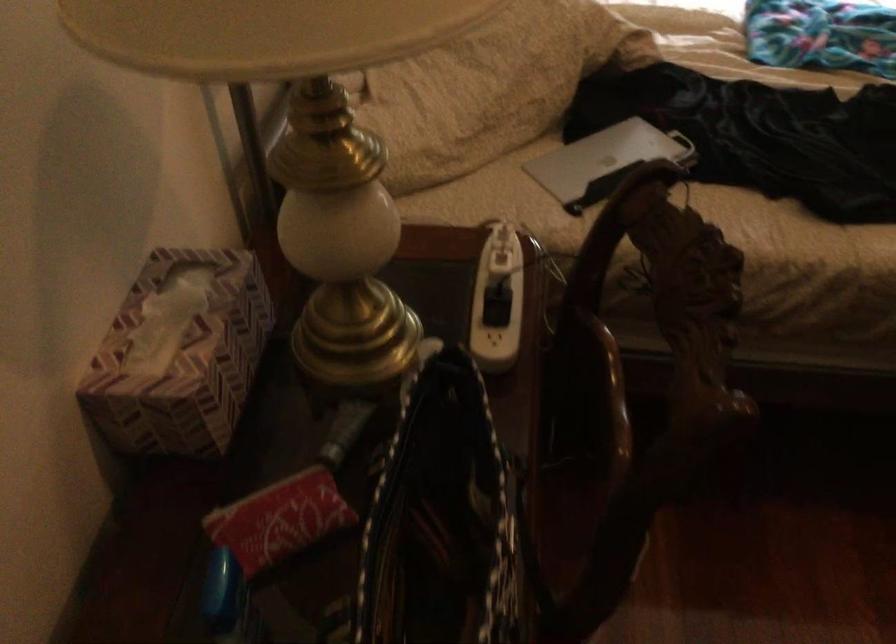
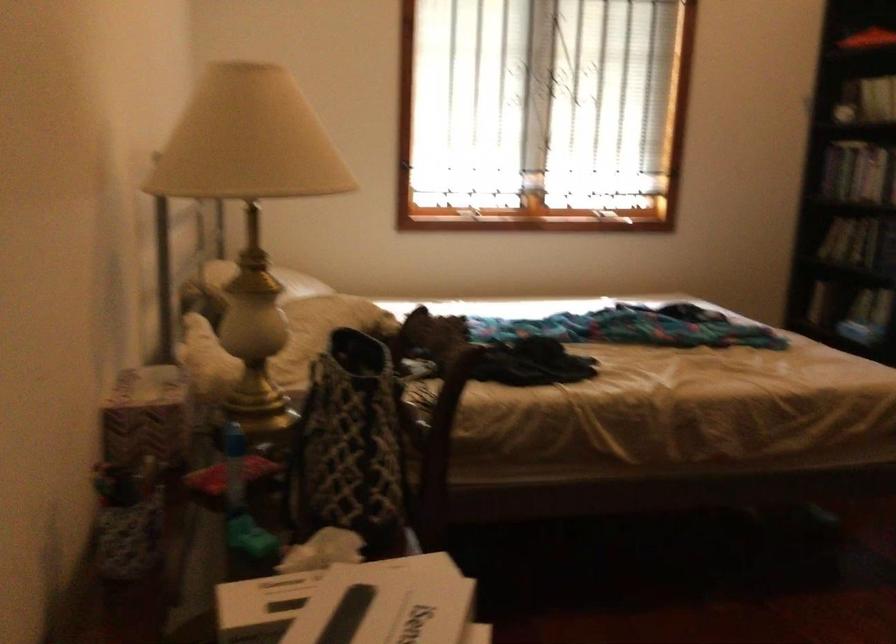
Based on the continuous images, in which direction is the camera rotating?

The rotation direction of the camera is right-up.